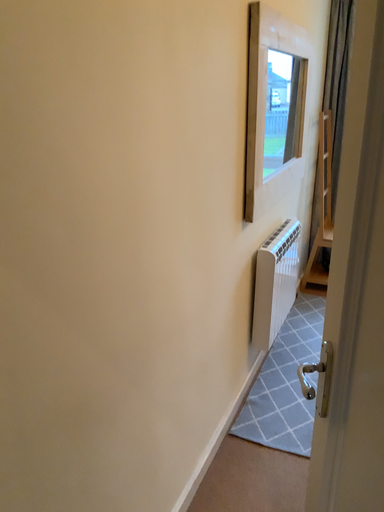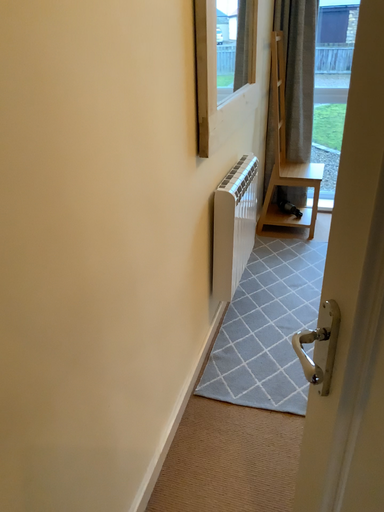
Question: Which way did the camera rotate in the video?

Choices:
 (A) rotated upward
 (B) rotated downward

Answer: (B)